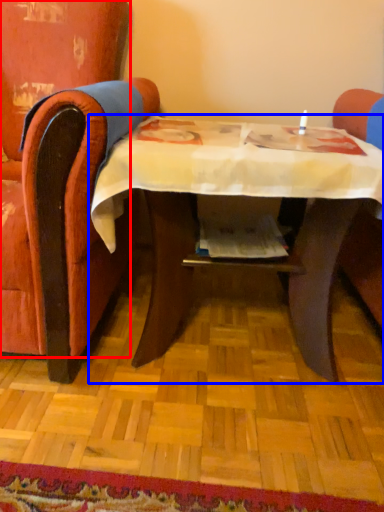
Question: Among these objects, which one is farthest to the camera, chair (highlighted by a red box) or table (highlighted by a blue box)?

Choices:
 (A) chair
 (B) table

Answer: (B)